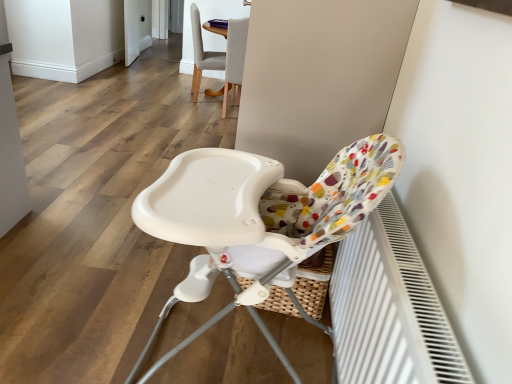
What is the approximate height of light gray fabric chair at upper center, the 1th chair viewed from the back?

95.40 centimeters.

Identify the location of white textured radiator at lower right. (389, 309).

Find the location of a particular element. white glossy screen door at upper left is located at coordinates (137, 28).

Locate an element on the screen. light gray fabric chair at upper center, arranged as the 3th chair when viewed from the front is located at coordinates (202, 54).

Between point (439, 358) and point (198, 53), which one is positioned behind?

The point (198, 53) is farther from the camera.

Is white textured radiator at lower right far away from light gray fabric chair at upper center, the 1th chair viewed from the back?

white textured radiator at lower right is far away from light gray fabric chair at upper center, the 1th chair viewed from the back.

Considering the sizes of white textured radiator at lower right and light gray fabric chair at upper center, which ranks as the 1th chair in top-to-bottom order, in the image, is white textured radiator at lower right bigger or smaller than light gray fabric chair at upper center, which ranks as the 1th chair in top-to-bottom order,?

white textured radiator at lower right is smaller than light gray fabric chair at upper center, which ranks as the 1th chair in top-to-bottom order.

You are a GUI agent. You are given a task and a screenshot of the screen. Output one action in this format:
    pyautogui.click(x=<x>, y=<y>)
    Task: Click on the radiator located on the right of light gray fabric chair at upper center, which ranks as the 1th chair in top-to-bottom order
    Image resolution: width=512 pixels, height=384 pixels.
    Given the screenshot: What is the action you would take?
    pyautogui.click(x=389, y=309)

From a real-world perspective, between light gray fabric chair at upper center, the 3th chair when ordered from bottom to top, and white glossy screen door at upper left, who is vertically higher?

light gray fabric chair at upper center, the 3th chair when ordered from bottom to top, is physically above.

Is light gray fabric chair at upper center, the 1th chair viewed from the back, oriented away from white glossy screen door at upper left?

No, white glossy screen door at upper left is not at the back of light gray fabric chair at upper center, the 1th chair viewed from the back.

Looking at this image, would you say light gray fabric chair at upper center, the 1th chair viewed from the back, is to the left or to the right of white glossy screen door at upper left in the picture?

Clearly, light gray fabric chair at upper center, the 1th chair viewed from the back, is on the right of white glossy screen door at upper left in the image.

Which object is further away from the camera, light gray fabric chair at upper center, which ranks as the 1th chair in top-to-bottom order, or white glossy screen door at upper left?

white glossy screen door at upper left is further from the camera.

Is white glossy screen door at upper left spatially inside matte gray chair at upper center, which is counted as the 2th chair, starting from the bottom, or outside of it?

white glossy screen door at upper left is not inside matte gray chair at upper center, which is counted as the 2th chair, starting from the bottom, it's outside.

I want to click on the 2nd chair in front of the white glossy screen door at upper left, so click(234, 59).

Considering the positions of objects white glossy screen door at upper left and matte gray chair at upper center, the 2th chair positioned from the top, in the image provided, who is more to the right, white glossy screen door at upper left or matte gray chair at upper center, the 2th chair positioned from the top,?

Positioned to the right is matte gray chair at upper center, the 2th chair positioned from the top.

Is white glossy screen door at upper left turned away from matte gray chair at upper center, the 2th chair in the front-to-back sequence?

No, matte gray chair at upper center, the 2th chair in the front-to-back sequence, is not at the back of white glossy screen door at upper left.

Does white plastic highchair at center, the first chair when ordered from bottom to top, have a larger size compared to matte gray chair at upper center, the 2th chair positioned from the top?

Indeed, white plastic highchair at center, the first chair when ordered from bottom to top, has a larger size compared to matte gray chair at upper center, the 2th chair positioned from the top.

How different are the orientations of white plastic highchair at center, positioned as the third chair in back-to-front order, and matte gray chair at upper center, the 2th chair positioned from the top, in degrees?

There is a 93.9-degree angle between the facing directions of white plastic highchair at center, positioned as the third chair in back-to-front order, and matte gray chair at upper center, the 2th chair positioned from the top.

Relative to matte gray chair at upper center, the 2th chair from the back, is white plastic highchair at center, positioned as the third chair in back-to-front order, in front or behind?

white plastic highchair at center, positioned as the third chair in back-to-front order, is positioned closer to the viewer than matte gray chair at upper center, the 2th chair from the back.

Between white plastic highchair at center, which is the first chair from front to back, and matte gray chair at upper center, the 2th chair from the back, which one appears on the right side from the viewer's perspective?

white plastic highchair at center, which is the first chair from front to back, is more to the right.

From a real-world perspective, is white plastic highchair at center, positioned as the third chair in back-to-front order, below white glossy screen door at upper left?

No, from a real-world perspective, white plastic highchair at center, positioned as the third chair in back-to-front order, is not below white glossy screen door at upper left.

Based on the photo, between white plastic highchair at center, positioned as the third chair in back-to-front order, and white glossy screen door at upper left, which one appears on the left side from the viewer's perspective?

From the viewer's perspective, white glossy screen door at upper left appears more on the left side.

Between white plastic highchair at center, which is the first chair from front to back, and white glossy screen door at upper left, which one has less height?

Standing shorter between the two is white glossy screen door at upper left.

Is matte gray chair at upper center, which is counted as the 2th chair, starting from the bottom, shorter than white textured radiator at lower right?

Incorrect, the height of matte gray chair at upper center, which is counted as the 2th chair, starting from the bottom, does not fall short of that of white textured radiator at lower right.

Is matte gray chair at upper center, the 2th chair from the back, directly adjacent to white textured radiator at lower right?

No, matte gray chair at upper center, the 2th chair from the back, is not beside white textured radiator at lower right.

Is the position of matte gray chair at upper center, the 2th chair positioned from the top, less distant than that of white textured radiator at lower right?

No, it is behind white textured radiator at lower right.

From a real-world perspective, which object stands above the other?

matte gray chair at upper center, the 2th chair positioned from the top.

From the image's perspective, which is above, white textured radiator at lower right or matte gray chair at upper center, the 2th chair from the back?

matte gray chair at upper center, the 2th chair from the back, is shown above in the image.

Is white textured radiator at lower right to the right of matte gray chair at upper center, which is counted as the 2th chair, starting from the bottom, from the viewer's perspective?

Yes.

Considering the points (432, 293) and (244, 35), which point is in front, point (432, 293) or point (244, 35)?

Point (432, 293)

In the scene shown: Between white textured radiator at lower right and matte gray chair at upper center, the 2th chair positioned from the top, which one has larger size?

matte gray chair at upper center, the 2th chair positioned from the top.

The width and height of the screenshot is (512, 384). What are the coordinates of `radiator lying on the right of light gray fabric chair at upper center, the 3th chair when ordered from bottom to top` in the screenshot? It's located at (389, 309).

Image resolution: width=512 pixels, height=384 pixels. I want to click on the 1st chair below the white glossy screen door at upper left (from the image's perspective), so click(x=202, y=54).

In the scene shown: When comparing their distances from white plastic highchair at center, positioned as the third chair in back-to-front order, does white textured radiator at lower right or matte gray chair at upper center, which is counted as the 2th chair, starting from the bottom, seem further?

matte gray chair at upper center, which is counted as the 2th chair, starting from the bottom, is positioned further to the anchor white plastic highchair at center, positioned as the third chair in back-to-front order.

Looking at the image, which one is located closer to light gray fabric chair at upper center, the 1th chair viewed from the back, matte gray chair at upper center, the 2th chair in the front-to-back sequence, or white plastic highchair at center, which is the first chair from front to back?

matte gray chair at upper center, the 2th chair in the front-to-back sequence, is positioned closer to the anchor light gray fabric chair at upper center, the 1th chair viewed from the back.

Based on their spatial positions, is white glossy screen door at upper left or white plastic highchair at center, positioned as the third chair in back-to-front order, closer to matte gray chair at upper center, the 2th chair in the front-to-back sequence?

white glossy screen door at upper left lies closer to matte gray chair at upper center, the 2th chair in the front-to-back sequence, than the other object.

From the image, which object appears to be nearer to white textured radiator at lower right, light gray fabric chair at upper center, which ranks as the 1th chair in top-to-bottom order, or white glossy screen door at upper left?

Based on the image, light gray fabric chair at upper center, which ranks as the 1th chair in top-to-bottom order, appears to be nearer to white textured radiator at lower right.

Estimate the real-world distances between objects in this image. Which object is further from white plastic highchair at center, which is the third chair in top-to-bottom order, white glossy screen door at upper left or white textured radiator at lower right?

white glossy screen door at upper left.

From the image, which object appears to be nearer to white glossy screen door at upper left, light gray fabric chair at upper center, the 1th chair viewed from the back, or white plastic highchair at center, positioned as the third chair in back-to-front order?

light gray fabric chair at upper center, the 1th chair viewed from the back, lies closer to white glossy screen door at upper left than the other object.

Which object lies further to the anchor point white textured radiator at lower right, light gray fabric chair at upper center, the 3th chair when ordered from bottom to top, or matte gray chair at upper center, the 2th chair in the front-to-back sequence?

light gray fabric chair at upper center, the 3th chair when ordered from bottom to top, is further to white textured radiator at lower right.

Looking at the image, which one is located closer to white glossy screen door at upper left, matte gray chair at upper center, the 2th chair from the back, or light gray fabric chair at upper center, the 1th chair viewed from the back?

The object closer to white glossy screen door at upper left is light gray fabric chair at upper center, the 1th chair viewed from the back.

Find the location of `chair between white textured radiator at lower right and matte gray chair at upper center, the 2th chair in the front-to-back sequence, along the z-axis`. chair between white textured radiator at lower right and matte gray chair at upper center, the 2th chair in the front-to-back sequence, along the z-axis is located at coordinates (260, 211).

In order to click on chair between white glossy screen door at upper left and matte gray chair at upper center, the 2th chair from the back, in the horizontal direction in this screenshot , I will do `click(202, 54)`.

Image resolution: width=512 pixels, height=384 pixels. Find the location of `chair between white plastic highchair at center, which is the third chair in top-to-bottom order, and light gray fabric chair at upper center, the 3th chair when ordered from bottom to top, from front to back`. chair between white plastic highchair at center, which is the third chair in top-to-bottom order, and light gray fabric chair at upper center, the 3th chair when ordered from bottom to top, from front to back is located at coordinates (234, 59).